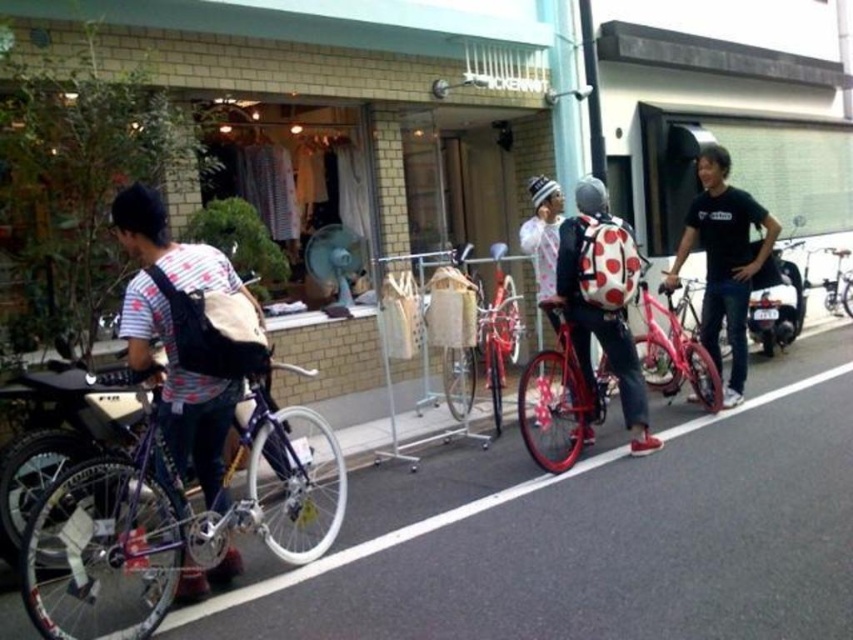
Who is taller, red matte bicycle at center or metallic silver bicycle at center?

With more height is red matte bicycle at center.

Is point (495, 275) more distant than point (836, 280)?

No, (495, 275) is closer to viewer.

I want to click on red matte bicycle at center, so click(486, 337).

Can you confirm if metallic pavement at center is taller than metallic silver bicycle at center?

No, metallic pavement at center is not taller than metallic silver bicycle at center.

Is metallic pavement at center below metallic silver bicycle at center?

Indeed, metallic pavement at center is positioned under metallic silver bicycle at center.

I want to click on metallic pavement at center, so click(592, 534).

I want to click on metallic pavement at center, so click(592, 534).

Based on the photo, is the position of matte black backpack at left less distant than that of polka dot backpack at center?

That is True.

Who is positioned more to the right, matte black backpack at left or polka dot backpack at center?

From the viewer's perspective, polka dot backpack at center appears more on the right side.

Is point (225, 432) positioned before point (556, 276)?

Yes.

What are the coordinates of `matte black backpack at left` in the screenshot? It's located at (173, 337).